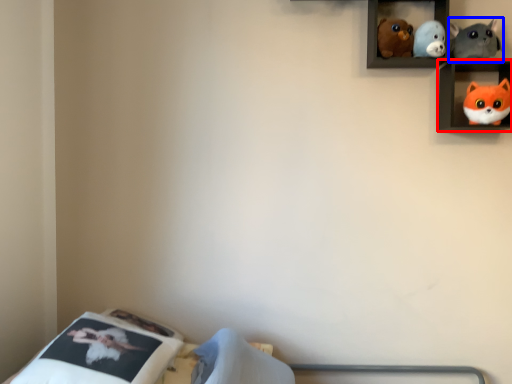
Question: Which point is further to the camera, shelf (highlighted by a red box) or toy (highlighted by a blue box)?

Choices:
 (A) shelf
 (B) toy

Answer: (B)